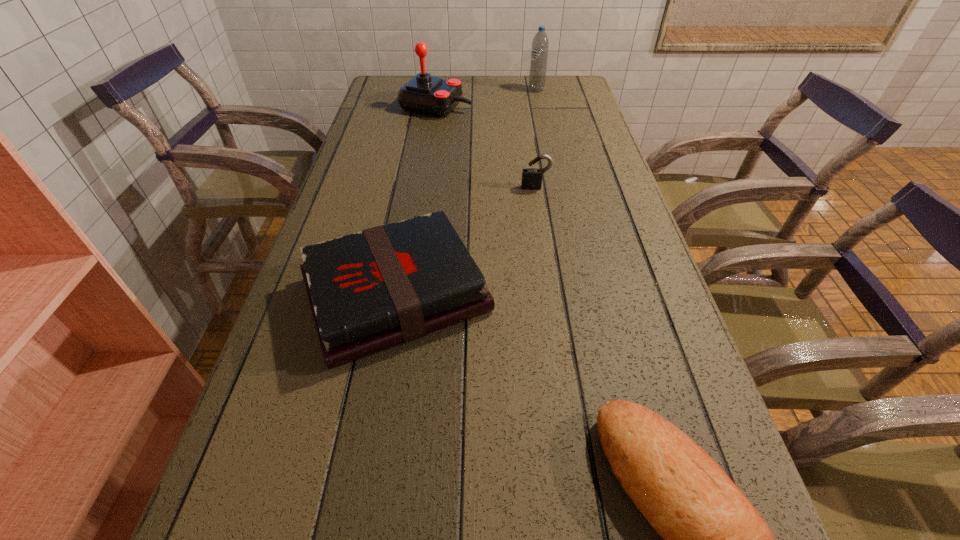
The width and height of the screenshot is (960, 540). Find the location of `free spot between the padlock and the hardback book`. free spot between the padlock and the hardback book is located at coordinates (466, 241).

You are a GUI agent. You are given a task and a screenshot of the screen. Output one action in this format:
    pyautogui.click(x=<x>, y=<y>)
    Task: Click on the unoccupied area between the second nearest object and the third farthest object
    Image resolution: width=960 pixels, height=540 pixels.
    Given the screenshot: What is the action you would take?
    pyautogui.click(x=466, y=241)

The width and height of the screenshot is (960, 540). I want to click on vacant space that is in between the water bottle and the second nearest object, so click(467, 192).

Identify the location of free space that is in between the water bottle and the joystick. (486, 98).

This screenshot has width=960, height=540. I want to click on empty space that is in between the padlock and the second nearest object, so click(x=466, y=241).

Locate an element on the screen. vacant area that lies between the hardback book and the fourth nearest object is located at coordinates (416, 201).

Identify the location of the second closest object relative to the shortest object. (531, 177).

At what (x,y) coordinates should I click in order to perform the action: click on object that is the fourth closest to the fourth farthest object. Please return your answer as a coordinate pair (x, y). Looking at the image, I should click on (539, 53).